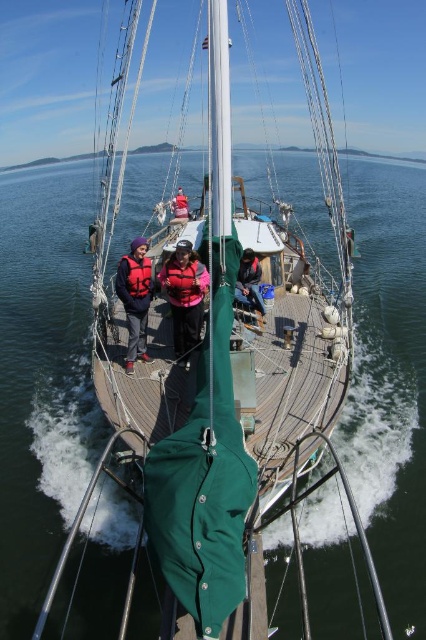
You are a sailor on the deck of the sailboat and need to choose between the matte black jacket at center and the red life jacket at center. Which one is larger?

The red life jacket at center is larger than the matte black jacket at center.

You are a sailor on the deck of the sailboat and need to quickly grab either the matte black jacket at center or the red life jacket at center. Which one is on your right side?

The matte black jacket at center is positioned on the right side of red life jacket at center, so the matte black jacket at center is on your right side.